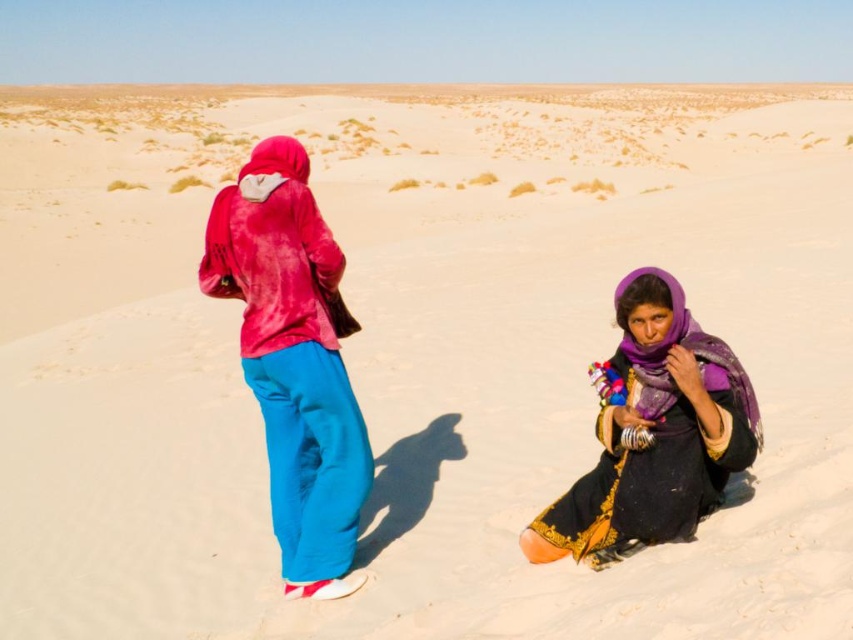
Question: Does velvet red jacket at upper left come in front of purple satin scarf at lower right?

Choices:
 (A) no
 (B) yes

Answer: (A)

Question: Can you confirm if velvet red jacket at upper left is wider than purple satin scarf at lower right?

Choices:
 (A) no
 (B) yes

Answer: (A)

Question: Can you confirm if velvet red jacket at upper left is smaller than purple satin scarf at lower right?

Choices:
 (A) yes
 (B) no

Answer: (B)